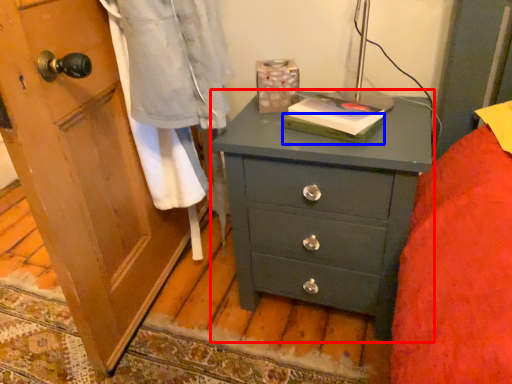
Question: Which point is closer to the camera, chest of drawers (highlighted by a red box) or book (highlighted by a blue box)?

Choices:
 (A) chest of drawers
 (B) book

Answer: (A)